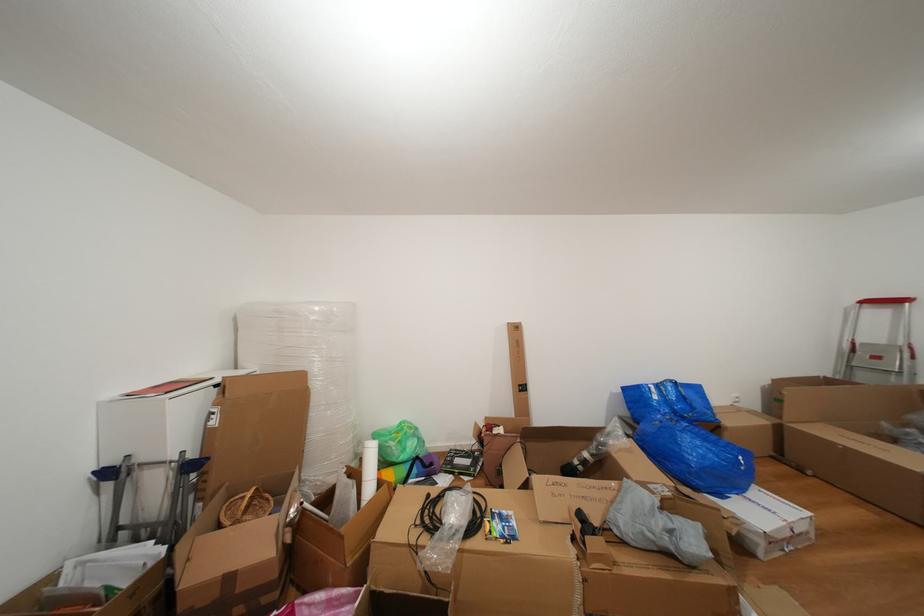
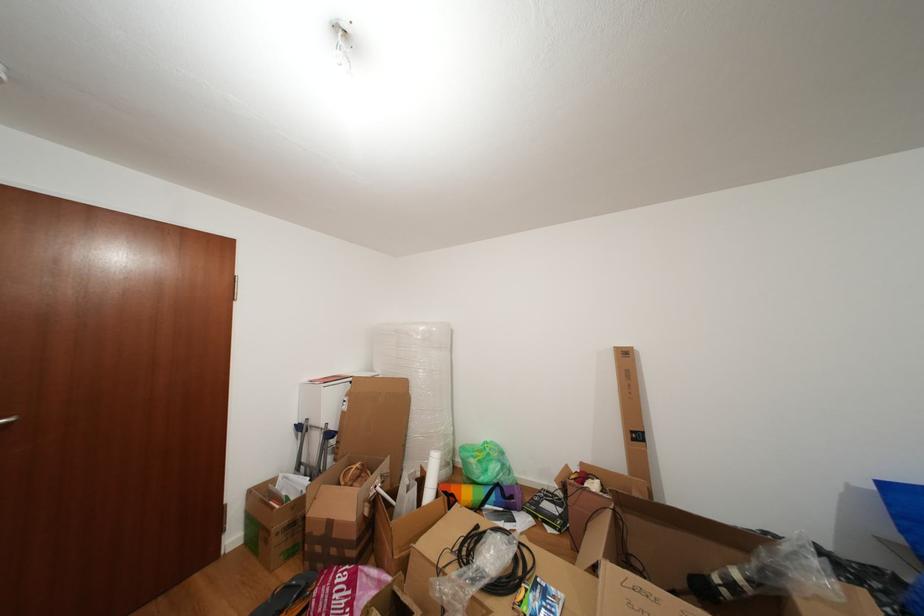
In the second image, find the point that corresponds to pixel 359 442 in the first image.

(450, 448)